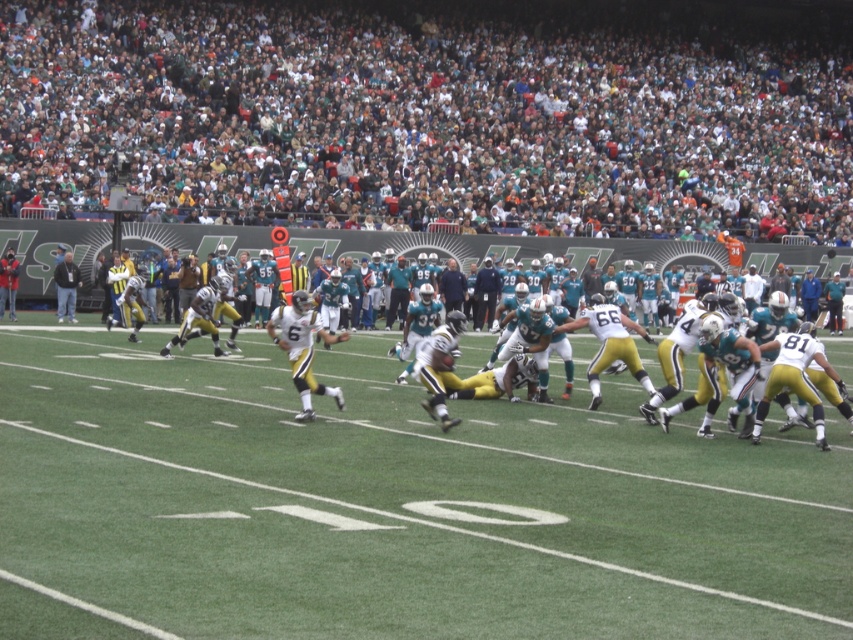
From the picture: Does white fabric crowd at upper center have a greater height compared to white jersey at center?

Correct, white fabric crowd at upper center is much taller as white jersey at center.

Is white fabric crowd at upper center thinner than white jersey at center?

Incorrect, white fabric crowd at upper center's width is not less than white jersey at center's.

What do you see at coordinates (415, 124) in the screenshot? The width and height of the screenshot is (853, 640). I see `white fabric crowd at upper center` at bounding box center [415, 124].

Identify the location of white fabric crowd at upper center. The image size is (853, 640). (415, 124).